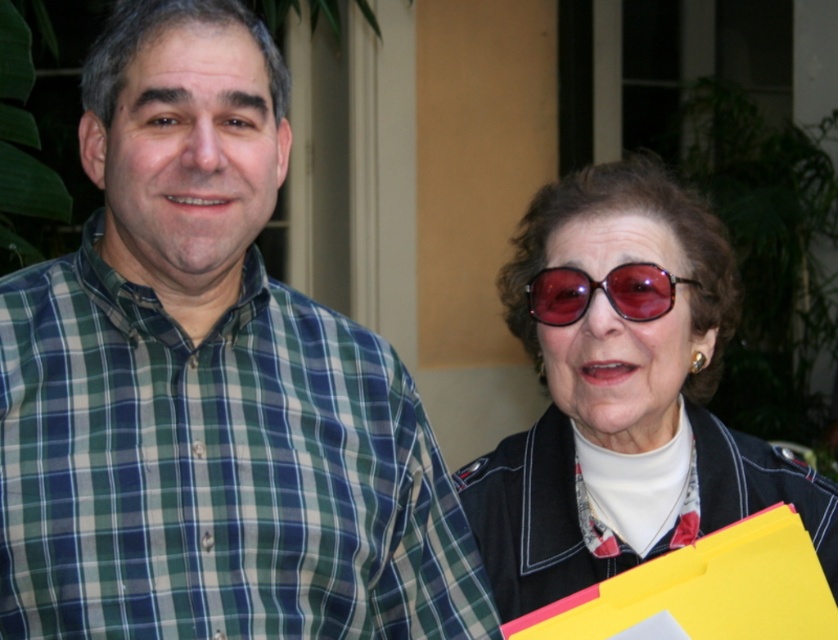
You are a photographer adjusting the lighting for a portrait. You notice the matte black sunglasses at upper right and the red tortoiseshell sunglasses at upper center in the frame. Which sunglasses are closer to the top of the image?

The red tortoiseshell sunglasses at upper center are closer to the top of the image because the matte black sunglasses at upper right is positioned under it.

You are a photographer standing 2 meters away from the camera position. You want to adjust your lens to focus on the matte black sunglasses at upper right. Is the distance within your camera lens range if the minimum focusing distance is 1.8 meters?

The matte black sunglasses at upper right is 1.91 meters away from the camera. Since the minimum focusing distance is 1.8 meters, the photographer can focus on the matte black sunglasses at upper right as the distance is within the lens range.

You are a photographer trying to capture a clear shot of both the green plaid shirt at center and the matte black sunglasses at upper right. Which object should you focus on first to ensure both are in focus?

You should focus on the green plaid shirt at center first because it is closer to the viewer than the matte black sunglasses at upper right. By focusing on the closer object, the depth of field may also keep the sunglasses in focus.